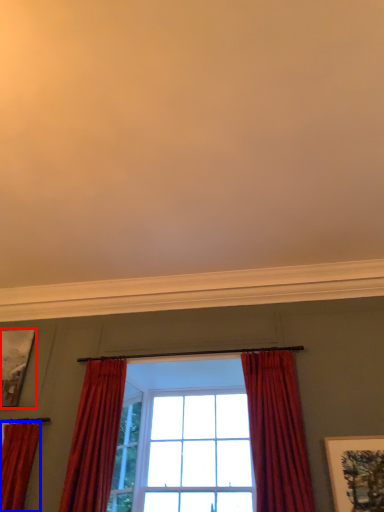
Question: Which point is further to the camera, picture frame (highlighted by a red box) or curtain (highlighted by a blue box)?

Choices:
 (A) picture frame
 (B) curtain

Answer: (A)